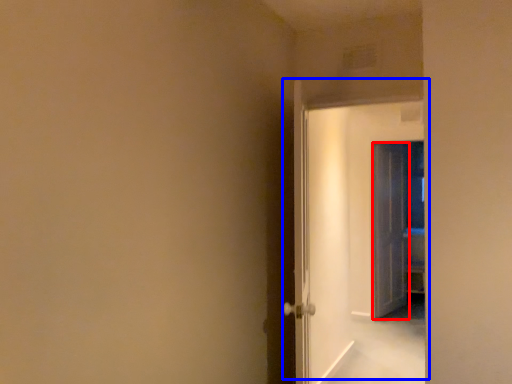
Question: Among these objects, which one is nearest to the camera, door (highlighted by a red box) or door (highlighted by a blue box)?

Choices:
 (A) door
 (B) door

Answer: (B)